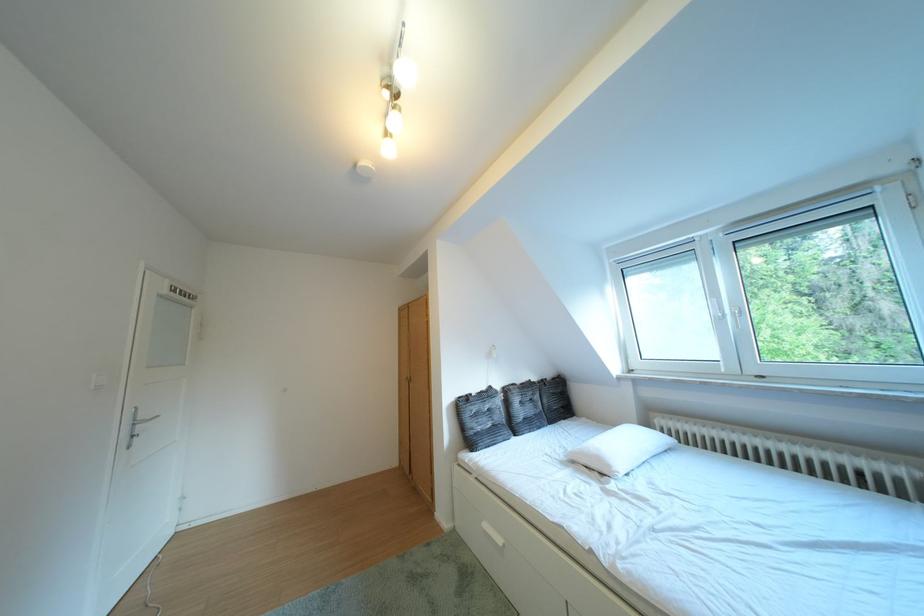
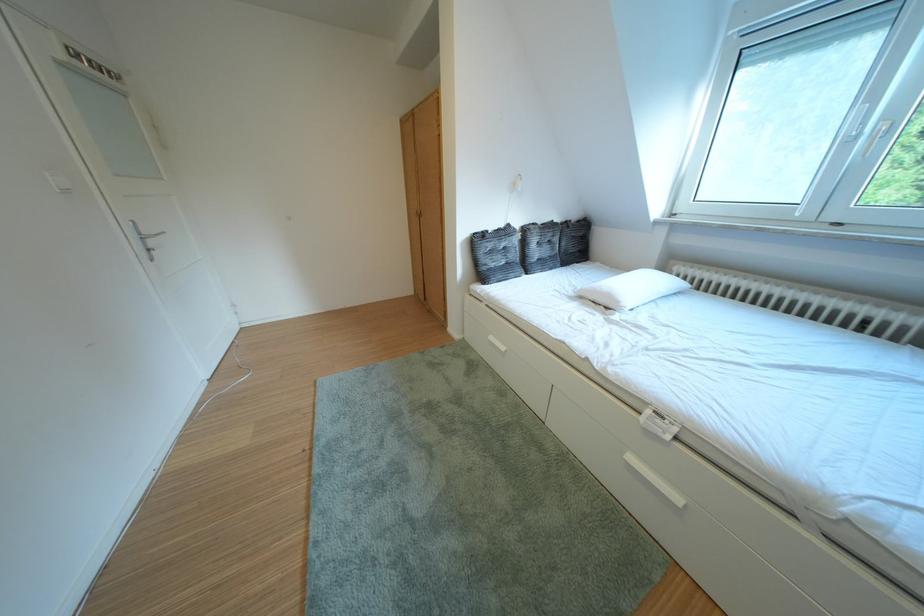
Question: The first image is from the beginning of the video and the second image is from the end. How did the camera likely rotate when shooting the video?

Choices:
 (A) Left
 (B) Right
 (C) Up
 (D) Down

Answer: (D)